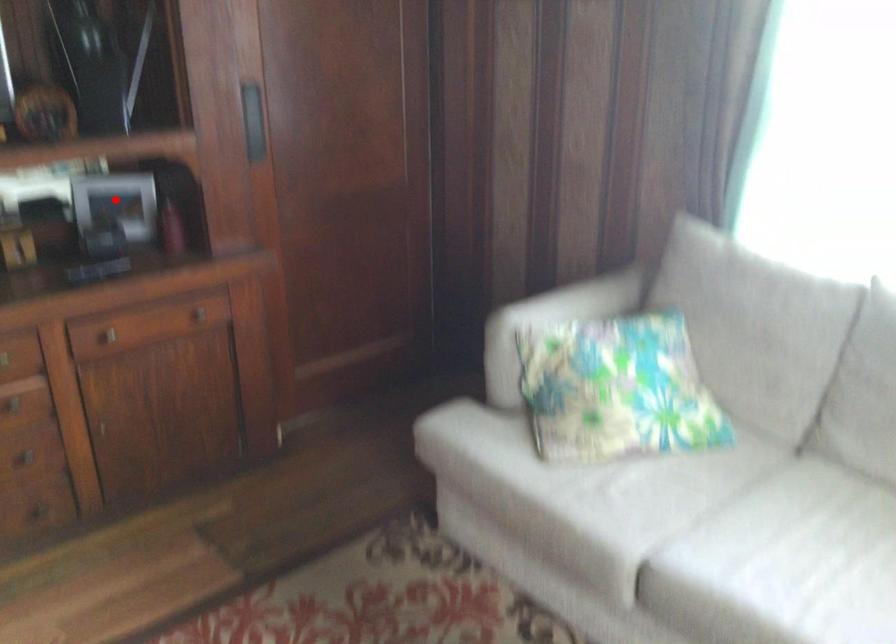
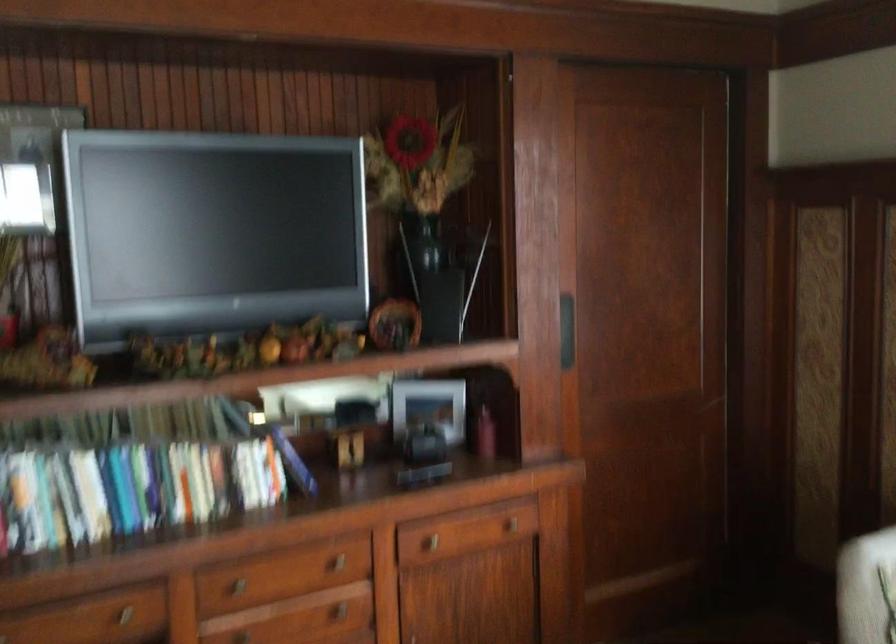
The point at the highlighted location is marked in the first image. Where is the corresponding point in the second image?

(428, 406)